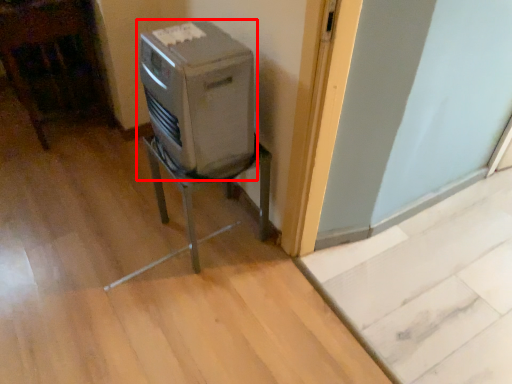
Question: From the image's perspective, considering the relative positions of home appliance (annotated by the red box) and furniture in the image provided, where is home appliance (annotated by the red box) located with respect to the staircase?

Choices:
 (A) below
 (B) above

Answer: (B)